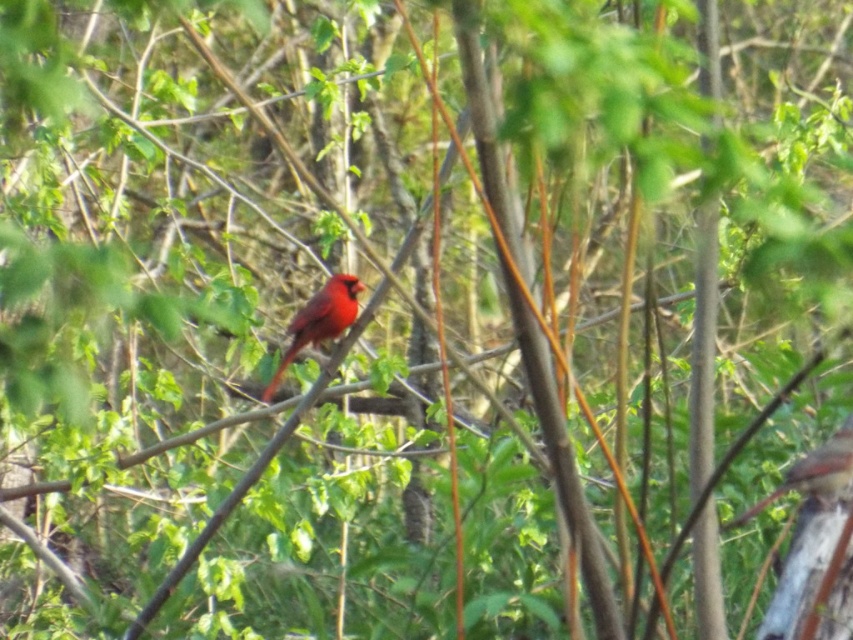
Is matte red cardinal at center behind matte red bird at center?

Yes, it is.

From the picture: Who is positioned more to the right, matte red cardinal at center or matte red bird at center?

Positioned to the right is matte red bird at center.

Locate an element on the screen. The width and height of the screenshot is (853, 640). matte red cardinal at center is located at coordinates (318, 321).

Where is `matte red cardinal at center`? matte red cardinal at center is located at coordinates (318, 321).